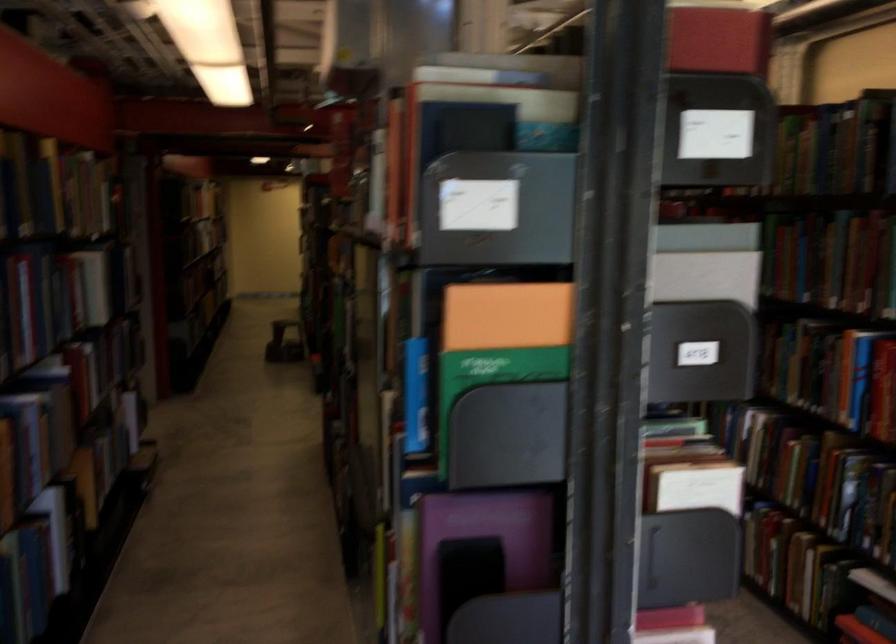
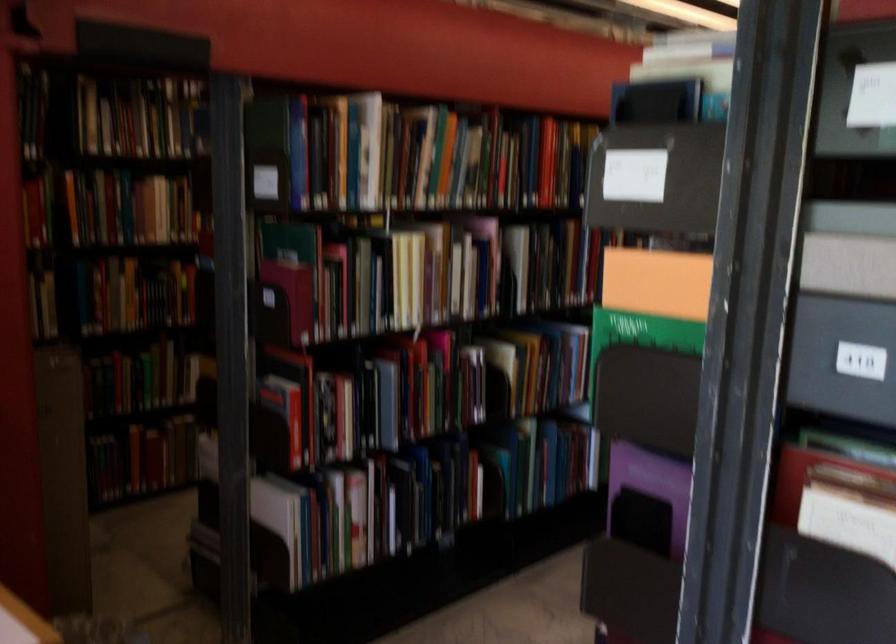
Find the pixel in the second image that matches (694,558) in the first image.

(864, 611)